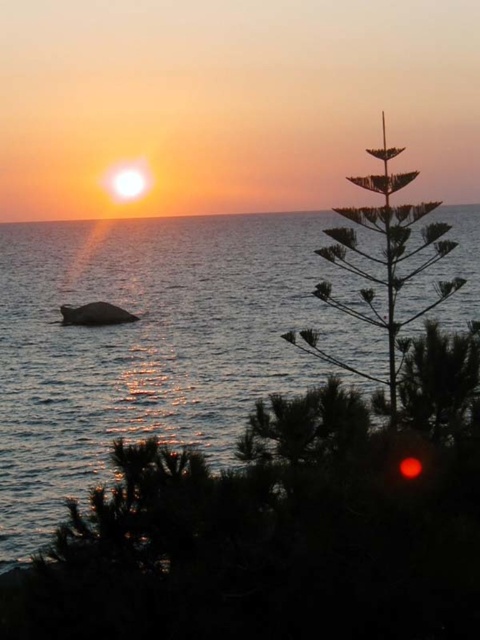
Question: Is glistening water at center further to the viewer compared to smooth ocean surface at center?

Choices:
 (A) yes
 (B) no

Answer: (B)

Question: Based on their relative distances, which object is nearer to the smooth ocean surface at center?

Choices:
 (A) glistening water at center
 (B) silvery metallic tree at right

Answer: (A)

Question: Which point is closer to the camera?

Choices:
 (A) (229, 209)
 (B) (367, 378)

Answer: (B)

Question: Does glistening water at center have a larger size compared to silvery metallic tree at right?

Choices:
 (A) no
 (B) yes

Answer: (B)

Question: Is glistening water at center smaller than smooth ocean surface at center?

Choices:
 (A) yes
 (B) no

Answer: (A)

Question: Which point is farther to the camera?

Choices:
 (A) glistening water at center
 (B) smooth ocean surface at center
 (C) silvery metallic tree at right

Answer: (B)